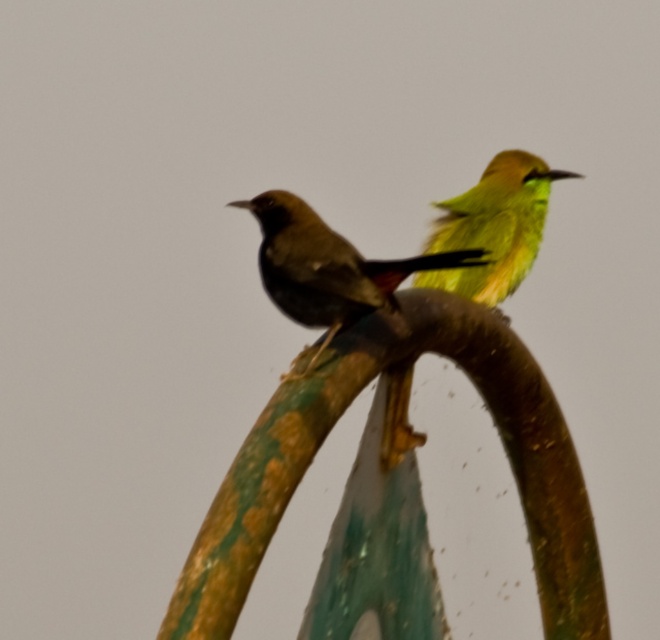
Question: In this image, where is shiny black bird at center located relative to green matte parrot at upper right?

Choices:
 (A) left
 (B) right

Answer: (A)

Question: Which of the following is the closest to the observer?

Choices:
 (A) shiny black bird at center
 (B) green matte parrot at upper right

Answer: (A)

Question: Is shiny black bird at center further to camera compared to green matte parrot at upper right?

Choices:
 (A) no
 (B) yes

Answer: (A)

Question: Which object is closer to the camera taking this photo?

Choices:
 (A) green matte parrot at upper right
 (B) shiny black bird at center

Answer: (B)

Question: Does shiny black bird at center appear over green matte parrot at upper right?

Choices:
 (A) no
 (B) yes

Answer: (A)

Question: Which point is farther to the camera?

Choices:
 (A) shiny black bird at center
 (B) green matte parrot at upper right

Answer: (B)